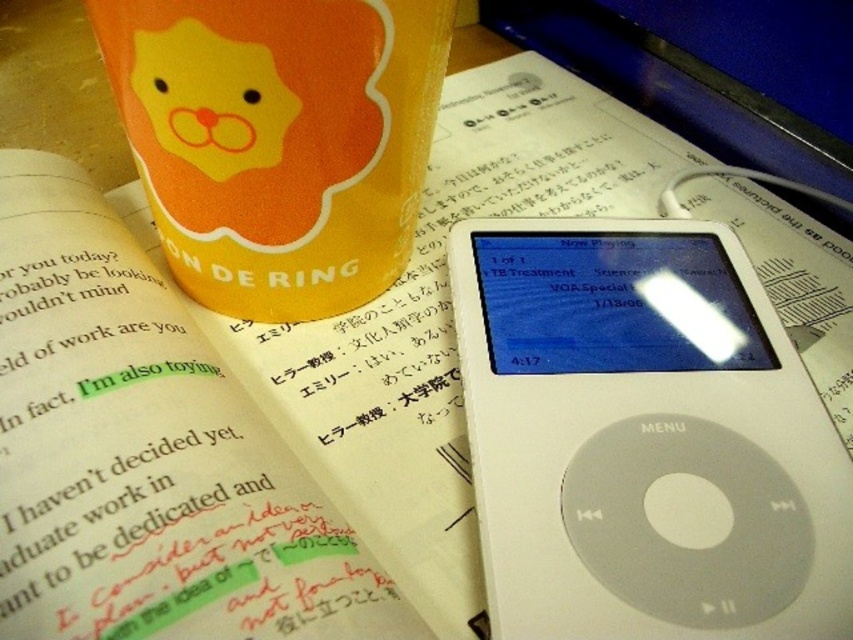
Question: Can you confirm if white plastic ipod at lower right is wider than orange matte cup at upper left?

Choices:
 (A) no
 (B) yes

Answer: (B)

Question: Does white plastic ipod at lower right appear under orange matte cup at upper left?

Choices:
 (A) no
 (B) yes

Answer: (B)

Question: Among these points, which one is nearest to the camera?

Choices:
 (A) (329, 20)
 (B) (769, 509)

Answer: (A)

Question: Among these objects, which one is farthest from the camera?

Choices:
 (A) orange matte cup at upper left
 (B) white plastic ipod at lower right

Answer: (B)

Question: From the image, what is the correct spatial relationship of white plastic ipod at lower right in relation to orange matte cup at upper left?

Choices:
 (A) below
 (B) above

Answer: (A)